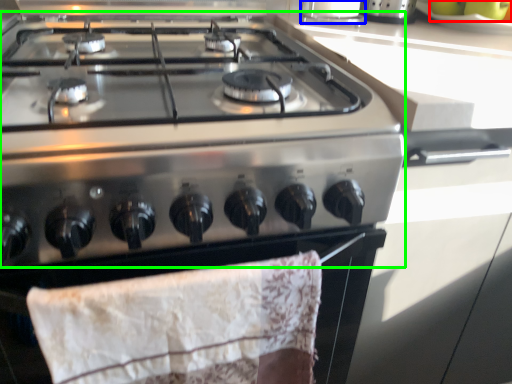
Question: Based on their relative distances, which object is nearer to fruit (highlighted by a red box)? Choose from kitchen appliance (highlighted by a blue box) and gas stove (highlighted by a green box).

Choices:
 (A) kitchen appliance
 (B) gas stove

Answer: (A)